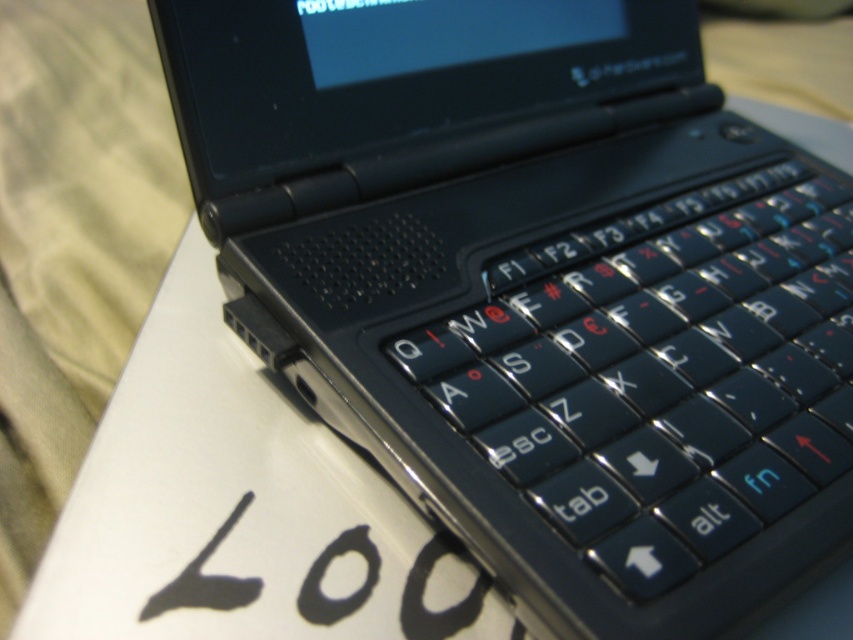
Can you confirm if black matte keyboard at center is bigger than black matte writing at lower left?

Indeed, black matte keyboard at center has a larger size compared to black matte writing at lower left.

The image size is (853, 640). I want to click on black matte keyboard at center, so click(x=660, y=372).